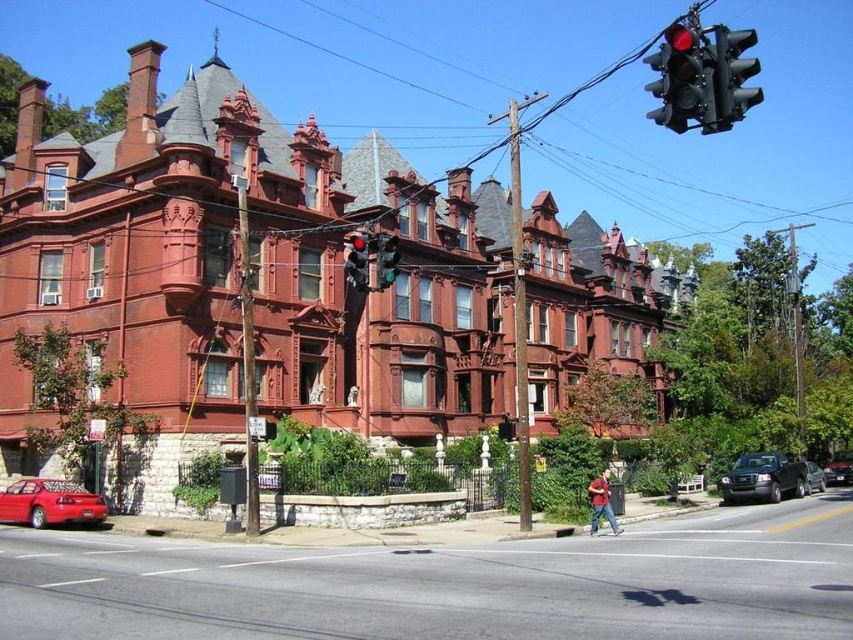
You are a pedestrian standing at the crosswalk and see both the matte black traffic light at center and the green glass traffic light at center. Which traffic light is positioned lower?

The matte black traffic light at center is below the green glass traffic light at center, so the matte black traffic light at center is positioned lower.

You are standing in front of the Victorian brick buildings and see two points marked on the ground. The first point is at coordinates point (358, 241) and the second is at point (379, 243). Which point is closer to you?

Point (379, 243) is closer to you because point (358, 241) is behind it.

Looking at this image, you are a pedestrian standing at the corner of the street looking towards the Victorian buildings. You see the metallic red traffic light at upper right and the shiny black sedan at center right. Which object is taller?

The metallic red traffic light at upper right is taller than the shiny black sedan at center right.